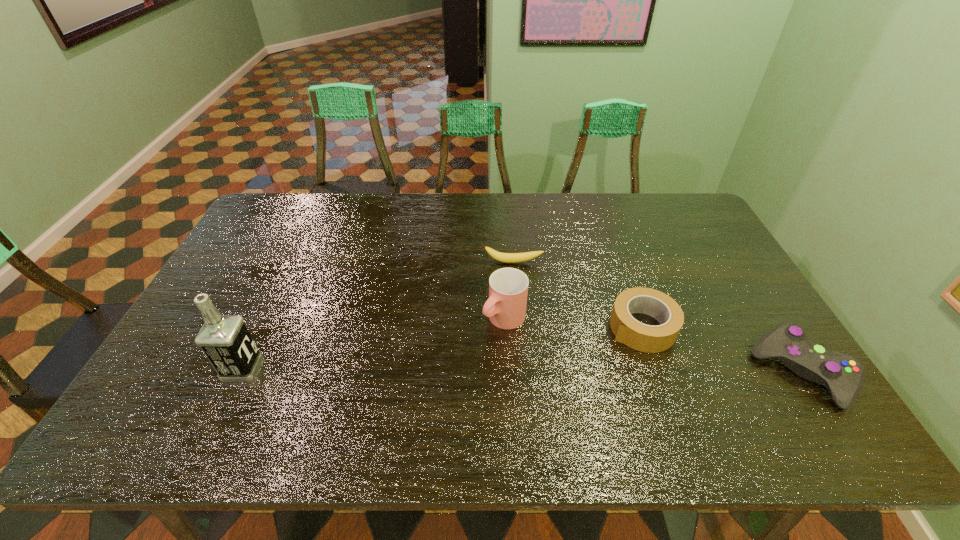
Where is `free space that is in between the leftmost object and the third tallest object`? This screenshot has height=540, width=960. free space that is in between the leftmost object and the third tallest object is located at coordinates (522, 370).

You are a GUI agent. You are given a task and a screenshot of the screen. Output one action in this format:
    pyautogui.click(x=<x>, y=<y>)
    Task: Click on the free area in between the duct tape and the banana
    The height and width of the screenshot is (540, 960).
    Given the screenshot: What is the action you would take?
    pyautogui.click(x=578, y=295)

This screenshot has height=540, width=960. Identify the location of free spot between the fourth object from left to right and the banana. (578, 295).

Where is `empty space between the vodka and the fourth object from left to right`? This screenshot has height=540, width=960. empty space between the vodka and the fourth object from left to right is located at coordinates (443, 348).

Where is `object that stands as the second closest to the fourth object from left to right`? The height and width of the screenshot is (540, 960). object that stands as the second closest to the fourth object from left to right is located at coordinates (508, 287).

Identify which object is the nearest to the rightmost object. Please provide its 2D coordinates. Your answer should be formatted as a tuple, i.e. [(x, y)], where the tuple contains the x and y coordinates of a point satisfying the conditions above.

[(646, 338)]